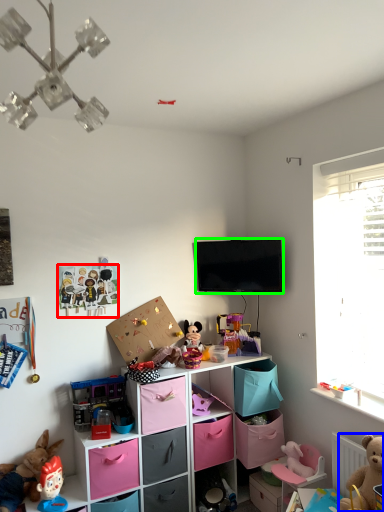
Question: Estimate the real-world distances between objects in this image. Which object is farther from toy (highlighted by a red box), toy (highlighted by a blue box) or television (highlighted by a green box)?

Choices:
 (A) toy
 (B) television

Answer: (A)